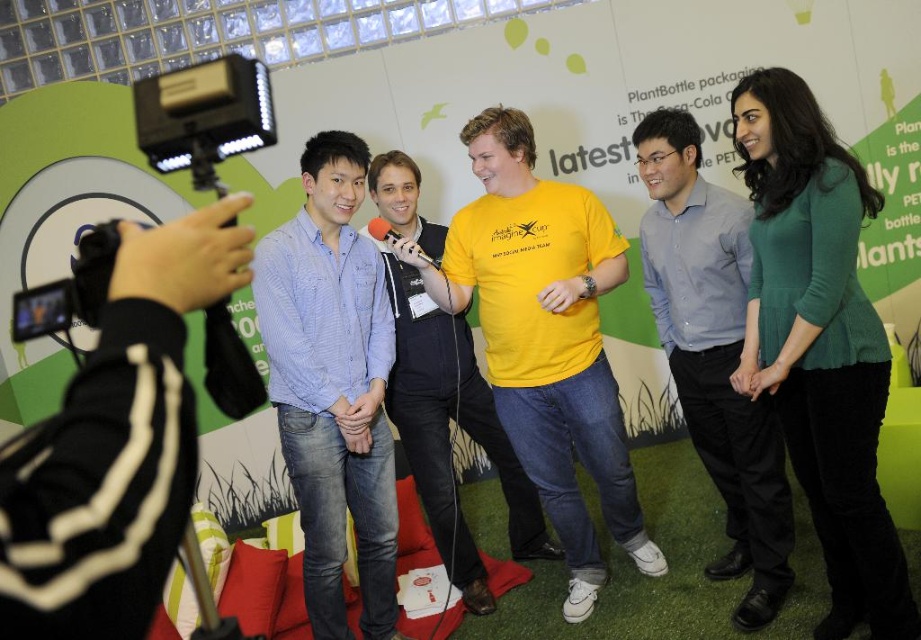
Question: Is green matte sweater at center smaller than light blue shirt at center?

Choices:
 (A) no
 (B) yes

Answer: (B)

Question: Which point is closer to the camera taking this photo?

Choices:
 (A) (516, 545)
 (B) (826, 266)

Answer: (B)

Question: Among these points, which one is nearest to the camera?

Choices:
 (A) (681, 248)
 (B) (321, 634)
 (C) (386, 234)
 (D) (461, 518)

Answer: (C)

Question: Which of the following is the farthest from the observer?

Choices:
 (A) (403, 275)
 (B) (889, 608)

Answer: (A)

Question: Is yellow matte t-shirt at center thinner than metallic silver microphone at center?

Choices:
 (A) yes
 (B) no

Answer: (B)

Question: From the image, what is the correct spatial relationship of green matte sweater at center in relation to yellow matte t-shirt at center?

Choices:
 (A) below
 (B) above

Answer: (B)